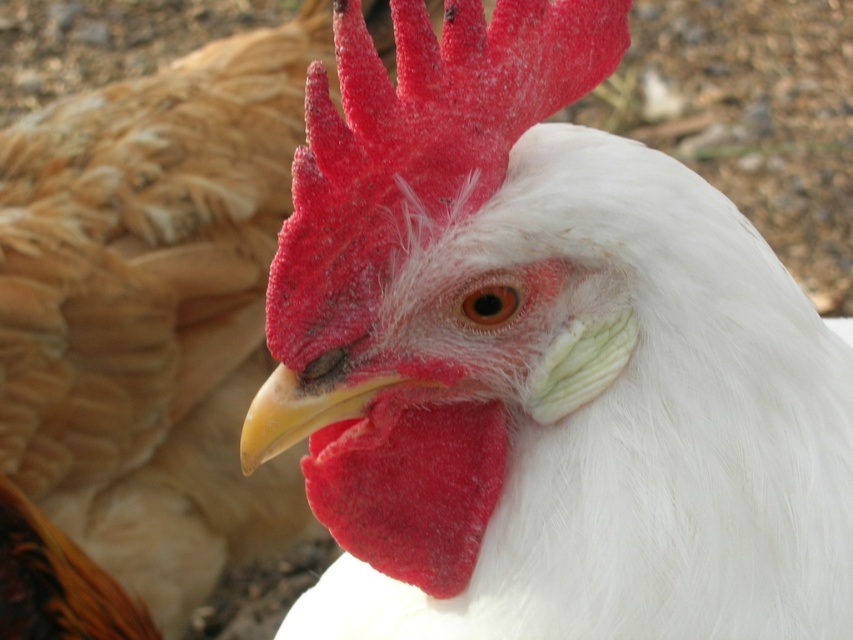
You are a photographer trying to capture a closeup of the chicken in the foreground. You notice two points in the image labeled as point (572, 285) and point (264, 438). Which point should you focus on to ensure the chicken in the foreground is sharp?

You should focus on point (264, 438) because it is in front of point (572, 285), which is closer to the camera and part of the foreground chicken.

You are a photographer standing 24 inches away from the white feathered rooster at center. Can you take a clear photo of it without moving closer?

The white feathered rooster at center and viewer are 23.25 inches apart from each other. Since you are standing 24 inches away, you are slightly farther than the required distance. Therefore, you can take a clear photo of the white feathered rooster at center without moving closer.

You are a photographer trying to capture a detailed closeup of the chicken in the image. You want to focus on the point at point (x=383, y=554). If your camera has a focusing range that can handle objects up to 30 inches away, will you be able to focus on that point?

The point (x=383, y=554) is 27.87 inches away from the camera, which is within the focusing range of up to 30 inches. Therefore, you can focus on the point (x=383, y=554).